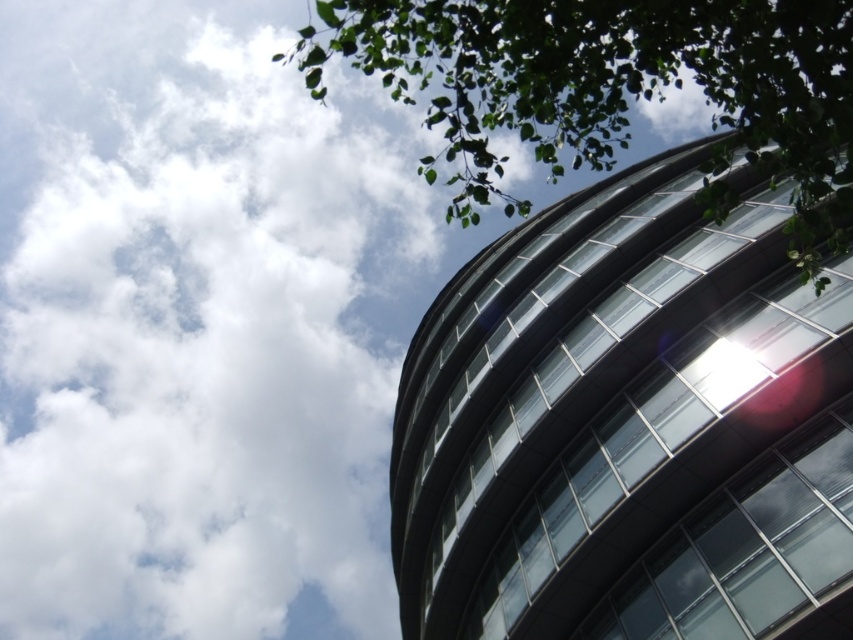
Question: Does white fluffy cloud at upper left appear under green leafy tree at upper right?

Choices:
 (A) no
 (B) yes

Answer: (B)

Question: Among these points, which one is farthest from the camera?

Choices:
 (A) (677, 68)
 (B) (506, 355)

Answer: (A)

Question: Does transparent glass building at upper right have a larger size compared to green leafy tree at upper right?

Choices:
 (A) no
 (B) yes

Answer: (A)

Question: Considering the relative positions of white fluffy cloud at upper left and transparent glass building at upper right in the image provided, where is white fluffy cloud at upper left located with respect to transparent glass building at upper right?

Choices:
 (A) left
 (B) right

Answer: (A)

Question: Which point is closer to the camera taking this photo?

Choices:
 (A) (636, 28)
 (B) (78, 22)

Answer: (A)

Question: Among these points, which one is nearest to the camera?

Choices:
 (A) (662, 625)
 (B) (561, 134)
 (C) (229, 186)

Answer: (B)